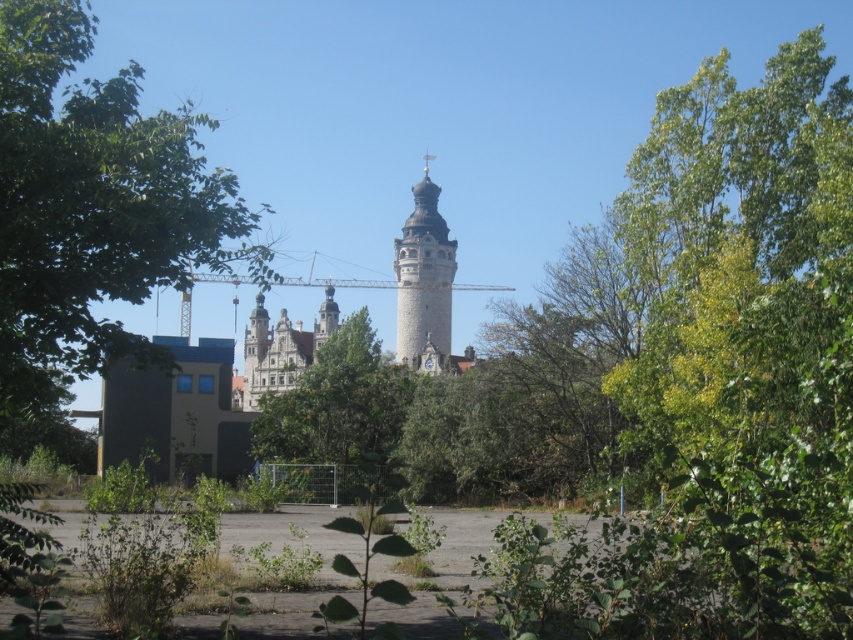
Question: Which of these objects is positioned farthest from the stone tower at center?

Choices:
 (A) green leafy tree at center
 (B) green leafy tree at left

Answer: (B)

Question: Which point is farther to the camera?

Choices:
 (A) (413, 211)
 (B) (0, 129)

Answer: (A)

Question: Can you confirm if green leafy tree at left is positioned below stone tower at center?

Choices:
 (A) yes
 (B) no

Answer: (B)

Question: Is green leafy tree at left above stone tower at center?

Choices:
 (A) no
 (B) yes

Answer: (B)

Question: Which point appears closest to the camera in this image?

Choices:
 (A) (374, 374)
 (B) (416, 209)
 (C) (258, 275)

Answer: (C)

Question: From the image, what is the correct spatial relationship of green leafy tree at center in relation to stone tower at center?

Choices:
 (A) right
 (B) left

Answer: (B)